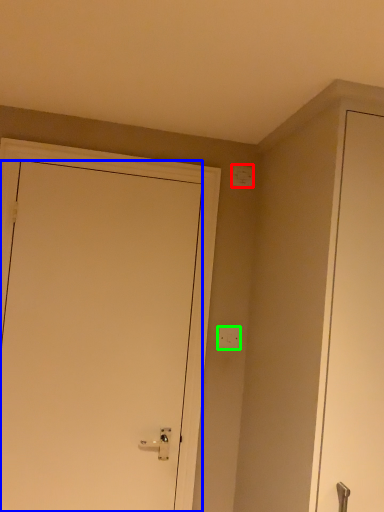
Question: Based on their relative distances, which object is nearer to light switch (highlighted by a red box)? Choose from door (highlighted by a blue box) and light switch (highlighted by a green box).

Choices:
 (A) door
 (B) light switch

Answer: (B)